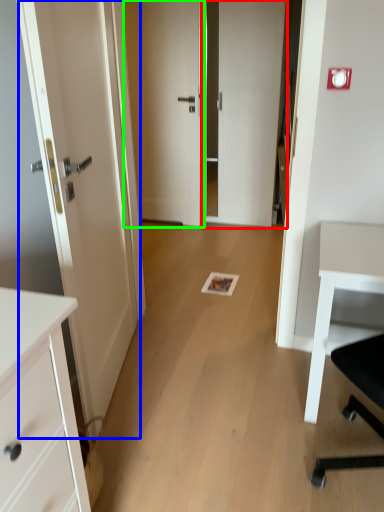
Question: Based on their relative distances, which object is nearer to door (highlighted by a red box)? Choose from door (highlighted by a blue box) and door (highlighted by a green box).

Choices:
 (A) door
 (B) door

Answer: (B)